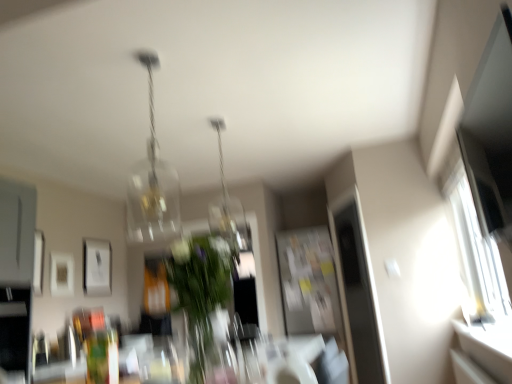
Locate an element on the screen. free point above translucent glass chandelier at upper center, which appears as the 2th lamp when viewed from the back (from a real-world perspective) is located at coordinates (147, 57).